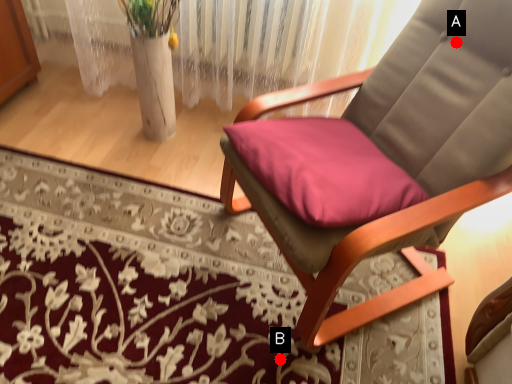
Question: Two points are circled on the image, labeled by A and B beside each circle. Which point is farther to the camera?

Choices:
 (A) A is further
 (B) B is further

Answer: (B)